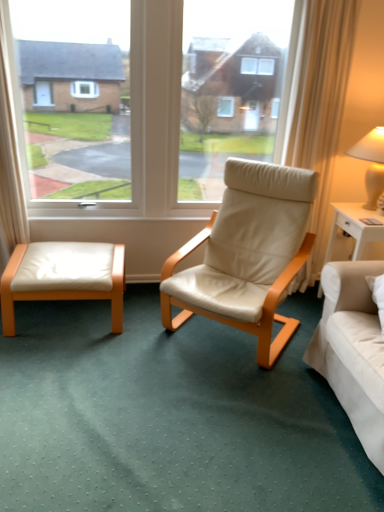
Locate an element on the screen. The width and height of the screenshot is (384, 512). vacant area in front of beige leather chair at center is located at coordinates (231, 414).